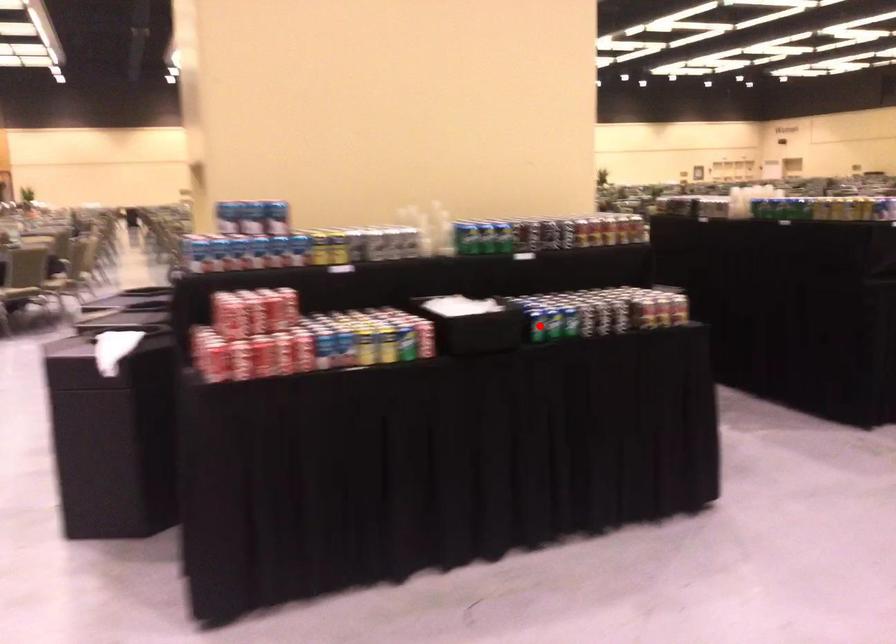
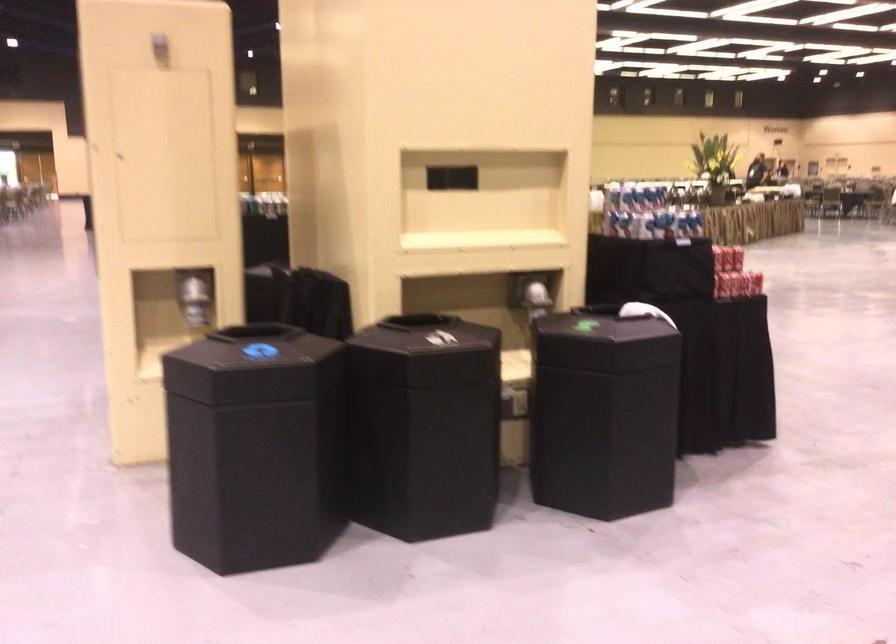
Question: I am providing you with two images of the same scene from different viewpoints. A red point is marked on the first image. Is the red point's position out of view in image 2?

Choices:
 (A) Yes
 (B) No

Answer: (A)